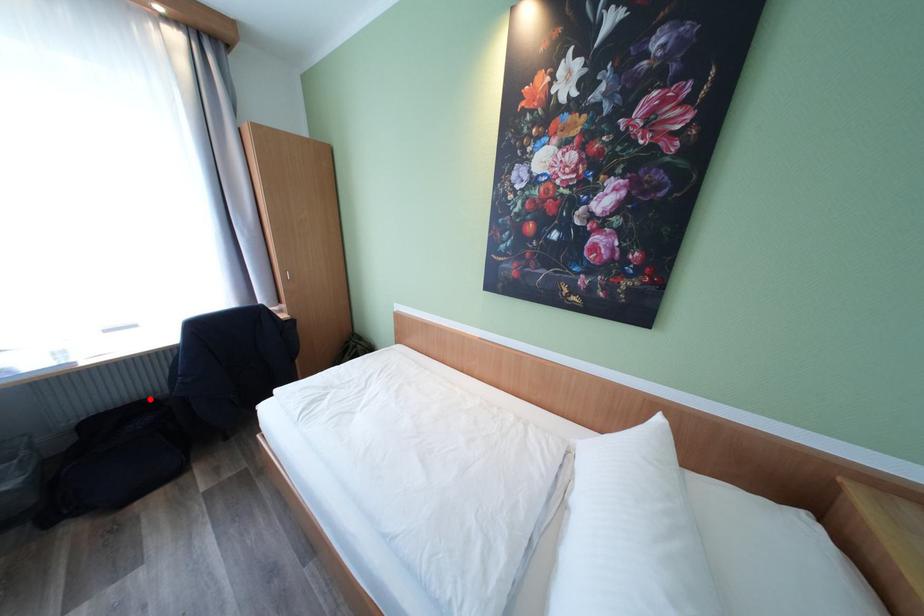
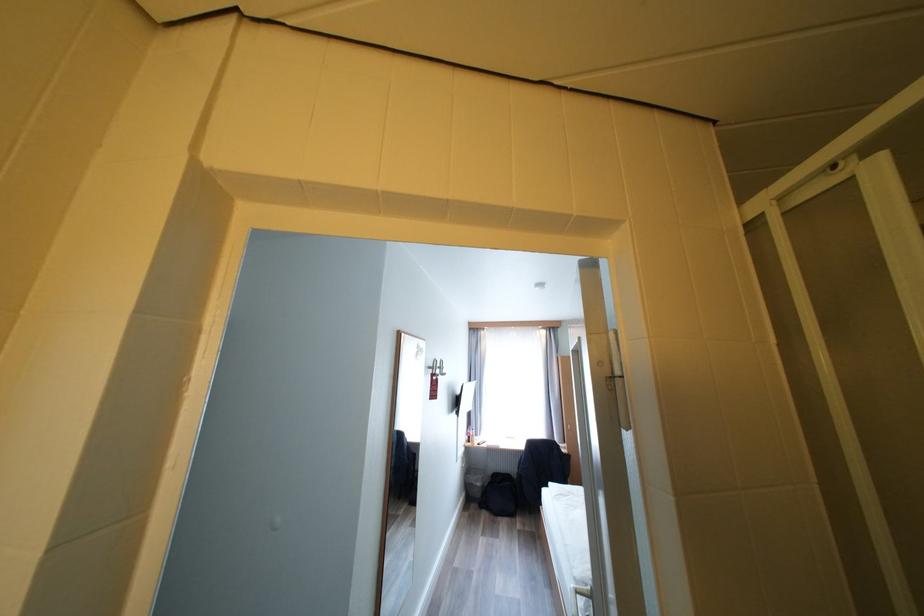
Where in the second image is the point corresponding to the highlighted location from the first image?

(516, 474)